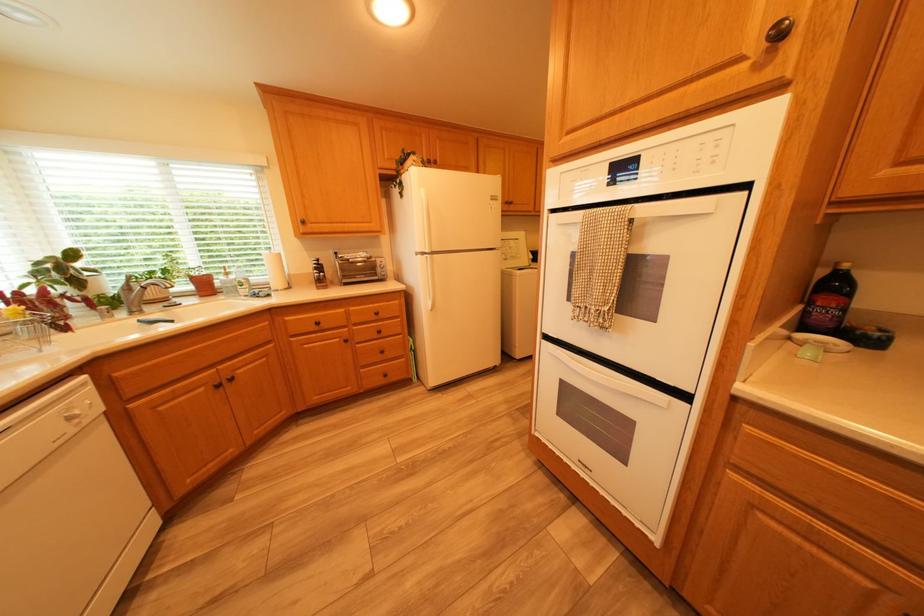
You are a GUI agent. You are given a task and a screenshot of the screen. Output one action in this format:
    pyautogui.click(x=<x>, y=<y>)
    Task: Click on the faucet handle
    This screenshot has height=616, width=924.
    Given the screenshot: What is the action you would take?
    pyautogui.click(x=155, y=297)